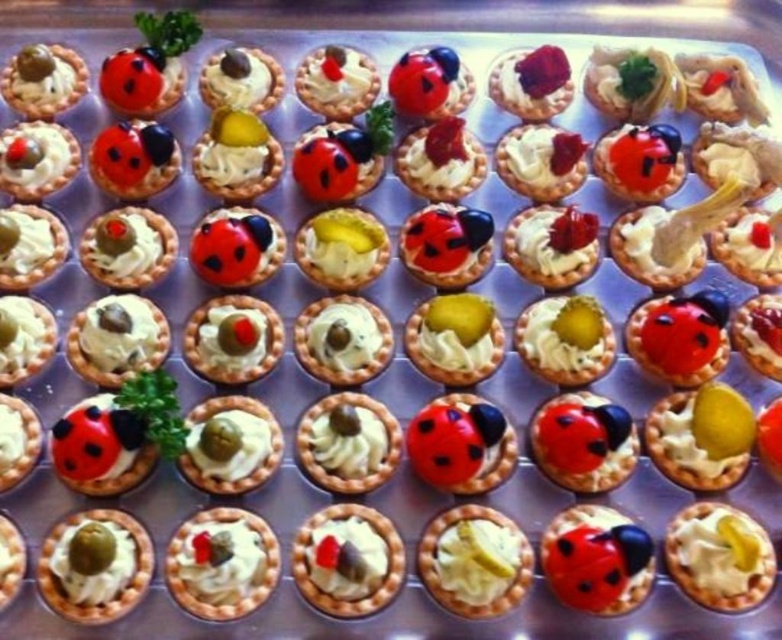
From the picture: Can you confirm if matte white tartlet at center is positioned to the right of matte white tartlet at lower left?

Indeed, matte white tartlet at center is positioned on the right side of matte white tartlet at lower left.

Does point (339, 577) lie in front of point (6, 592)?

Yes, it is in front of point (6, 592).

Is point (381, 561) positioned in front of point (15, 548)?

That is True.

Identify the location of matte white tartlet at center. (346, 561).

Is white cream tart at center positioned behind matte white tartlet at center?

No, it is in front of matte white tartlet at center.

The width and height of the screenshot is (782, 640). I want to click on white cream tart at center, so click(x=221, y=563).

Who is more distant from viewer, (174, 531) or (377, 547)?

The point (174, 531) is behind.

I want to click on white cream tart at center, so click(x=221, y=563).

Between green matte olive at lower left and matte cream tartlet at center, which one is positioned higher?

matte cream tartlet at center is above.

Is green matte olive at lower left in front of matte cream tartlet at center?

Yes, it is in front of matte cream tartlet at center.

Is point (142, 572) less distant than point (543, 58)?

Yes.

Image resolution: width=782 pixels, height=640 pixels. In order to click on green matte olive at lower left in this screenshot , I will do `click(95, 564)`.